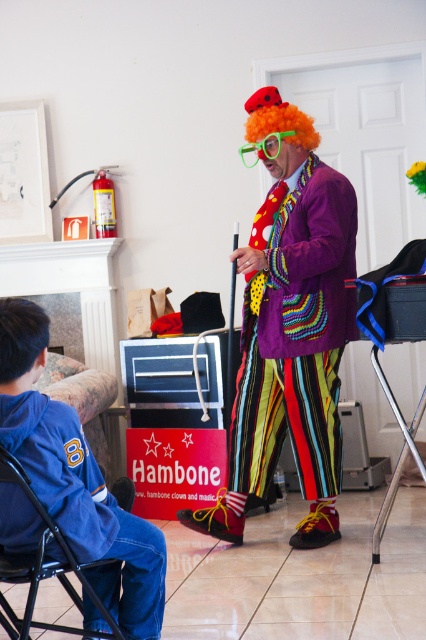
You are planning to pack a bag for a trip and have both the blue denim jacket at lower left and the blue fabric folding chair at lower left. Which item takes up more space?

The blue denim jacket at lower left has a larger size compared to the blue fabric folding chair at lower left, so it takes up more space.